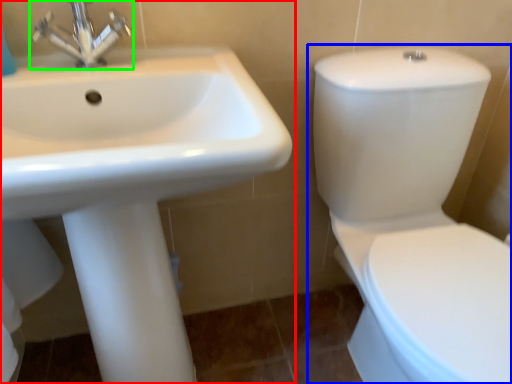
Question: Based on their relative distances, which object is nearer to sink (highlighted by a red box)? Choose from toilet (highlighted by a blue box) and tap (highlighted by a green box).

Choices:
 (A) toilet
 (B) tap

Answer: (B)